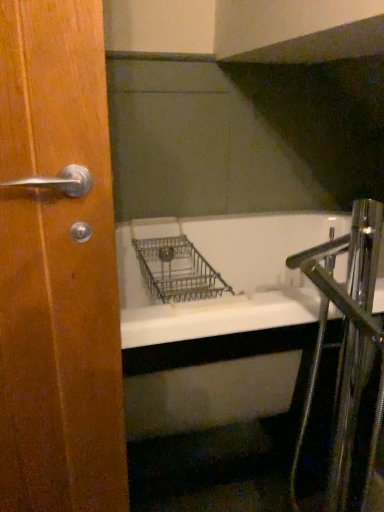
Identify the location of chrome metallic faucet at right. This screenshot has width=384, height=512. (346, 343).

Image resolution: width=384 pixels, height=512 pixels. Describe the element at coordinates (346, 343) in the screenshot. I see `chrome metallic faucet at right` at that location.

The height and width of the screenshot is (512, 384). What do you see at coordinates (58, 268) in the screenshot?
I see `wooden door handle at left` at bounding box center [58, 268].

Find the location of `wooden door handle at left`. wooden door handle at left is located at coordinates (58, 268).

Where is `chrome metallic faucet at right`? The image size is (384, 512). chrome metallic faucet at right is located at coordinates (346, 343).

Can you confirm if wooden door handle at left is positioned to the right of chrome metallic faucet at right?

No.

Considering their positions, is wooden door handle at left located in front of or behind chrome metallic faucet at right?

wooden door handle at left is in front of chrome metallic faucet at right.

Is point (99, 76) farther from camera compared to point (371, 305)?

That is False.

From the image's perspective, would you say wooden door handle at left is shown under chrome metallic faucet at right?

No.

Based on the photo, from a real-world perspective, is wooden door handle at left on top of chrome metallic faucet at right?

Correct, in the physical world, wooden door handle at left is higher than chrome metallic faucet at right.

Between wooden door handle at left and chrome metallic faucet at right, which one has larger width?

chrome metallic faucet at right is wider.

From their relative heights in the image, would you say wooden door handle at left is taller or shorter than chrome metallic faucet at right?

Clearly, wooden door handle at left is taller compared to chrome metallic faucet at right.

Considering the sizes of objects wooden door handle at left and chrome metallic faucet at right in the image provided, who is smaller, wooden door handle at left or chrome metallic faucet at right?

wooden door handle at left is smaller.

Based on the photo, is chrome metallic faucet at right located within wooden door handle at left?

No, chrome metallic faucet at right is located outside of wooden door handle at left.

Based on the photo, is wooden door handle at left with chrome metallic faucet at right?

No, wooden door handle at left is not touching chrome metallic faucet at right.

Looking at this image, does wooden door handle at left turn towards chrome metallic faucet at right?

No, wooden door handle at left is not turned towards chrome metallic faucet at right.

In the scene shown: How much distance is there between wooden door handle at left and chrome metallic faucet at right?

wooden door handle at left is 21.54 inches away from chrome metallic faucet at right.

In order to click on faucet located behind the wooden door handle at left in this screenshot , I will do `click(346, 343)`.

Between chrome metallic faucet at right and wooden door handle at left, which one appears on the right side from the viewer's perspective?

chrome metallic faucet at right is more to the right.

Relative to wooden door handle at left, is chrome metallic faucet at right in front or behind?

chrome metallic faucet at right is behind wooden door handle at left.

Is point (342, 405) less distant than point (20, 105)?

No, (342, 405) is further to viewer.

From the picture: From the image's perspective, is chrome metallic faucet at right above or below wooden door handle at left?

From the image's perspective, chrome metallic faucet at right appears below wooden door handle at left.

Based on the photo, from a real-world perspective, between chrome metallic faucet at right and wooden door handle at left, who is vertically lower?

chrome metallic faucet at right is physically lower.

Considering the relative sizes of chrome metallic faucet at right and wooden door handle at left in the image provided, is chrome metallic faucet at right thinner than wooden door handle at left?

No, chrome metallic faucet at right is not thinner than wooden door handle at left.

Which of these two, chrome metallic faucet at right or wooden door handle at left, stands shorter?

With less height is chrome metallic faucet at right.

Is chrome metallic faucet at right smaller than wooden door handle at left?

No.

Is chrome metallic faucet at right not inside wooden door handle at left?

chrome metallic faucet at right is positioned outside wooden door handle at left.

Is chrome metallic faucet at right positioned far away from wooden door handle at left?

No, there isn't a large distance between chrome metallic faucet at right and wooden door handle at left.

Is chrome metallic faucet at right aimed at wooden door handle at left?

Yes, chrome metallic faucet at right faces towards wooden door handle at left.

How different are the orientations of chrome metallic faucet at right and wooden door handle at left in degrees?

chrome metallic faucet at right and wooden door handle at left are facing 90.4 degrees away from each other.

Where is `faucet located below the wooden door handle at left (from the image's perspective)`? faucet located below the wooden door handle at left (from the image's perspective) is located at coordinates (346, 343).

Find the location of `faucet below the wooden door handle at left (from a real-world perspective)`. faucet below the wooden door handle at left (from a real-world perspective) is located at coordinates click(346, 343).

Locate an element on the screen. faucet on the right of wooden door handle at left is located at coordinates (346, 343).